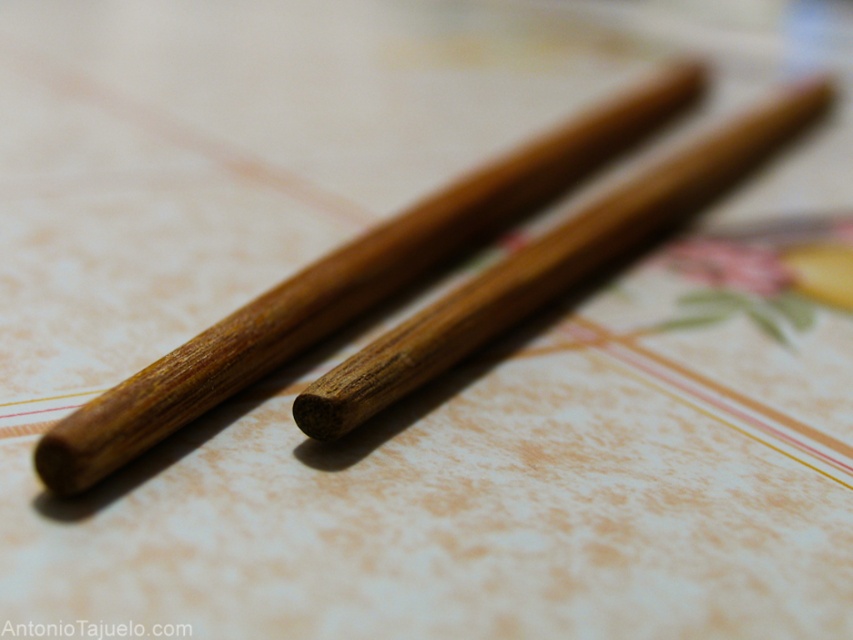
You are setting up a table for a meal and have both the wooden chopsticks at center and the brown wood chopstick at center. Which one is wider?

The wooden chopsticks at center are wider than the brown wood chopstick at center.

You are looking at a table with two chopsticks. The wooden chopsticks at center and the brown wood chopstick at center. Which one is closer to you?

The wooden chopsticks at center are closer to the viewer than the brown wood chopstick at center according to the description.